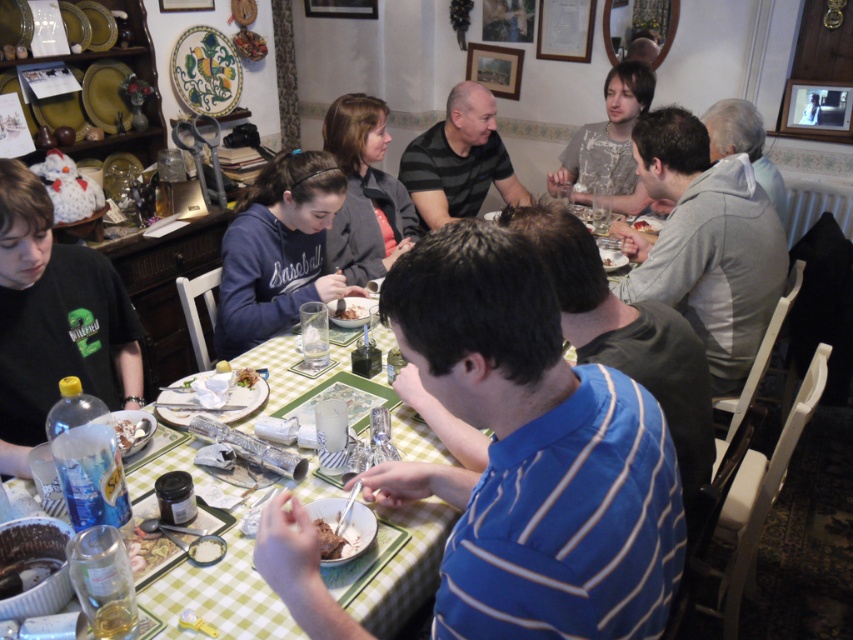
Who is higher up, smooth white bowl at center or smooth white plate at center?

smooth white plate at center is higher up.

Which is in front, point (120, 428) or point (643, 225)?

Point (120, 428) is more forward.

Is point (140, 433) closer to viewer compared to point (654, 228)?

Yes.

Find the location of `smooth white bowl at center`. smooth white bowl at center is located at coordinates (131, 433).

In the scene shown: Can you confirm if smooth white bowl at center is positioned above white matte bread at center?

No, smooth white bowl at center is not above white matte bread at center.

Is smooth white bowl at center positioned before white matte bread at center?

Yes.

The image size is (853, 640). In order to click on smooth white bowl at center in this screenshot , I will do `click(131, 433)`.

Find the location of a particular element. This screenshot has height=640, width=853. smooth white bowl at center is located at coordinates (131, 433).

In the scene shown: Is gray fleece jacket at upper right bigger than white matte bread at center?

Indeed, gray fleece jacket at upper right has a larger size compared to white matte bread at center.

Can you confirm if gray fleece jacket at upper right is wider than white matte bread at center?

Yes.

Which is in front, point (735, 368) or point (219, 362)?

Point (219, 362)

Where is `gray fleece jacket at upper right`? This screenshot has height=640, width=853. gray fleece jacket at upper right is located at coordinates (705, 243).